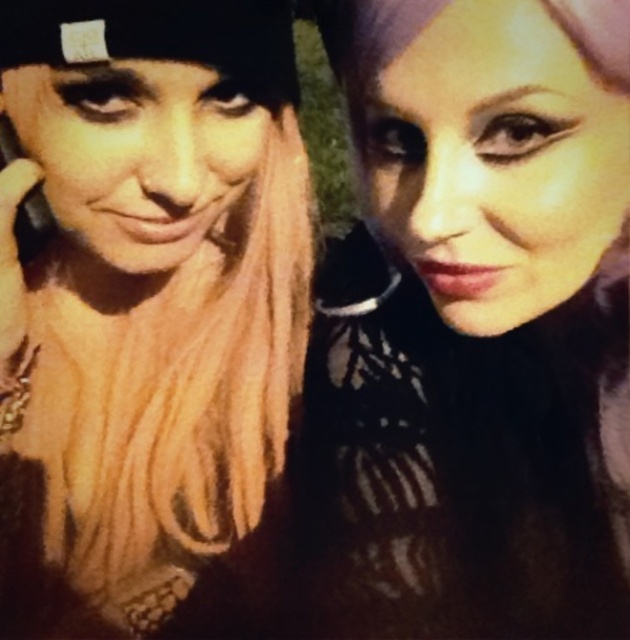
Question: Does matte black hair at center have a lesser width compared to matte black beanie at upper left?

Choices:
 (A) yes
 (B) no

Answer: (B)

Question: Which point appears closest to the camera in this image?

Choices:
 (A) (581, 154)
 (B) (3, 636)

Answer: (A)

Question: Which of the following is the farthest from the observer?

Choices:
 (A) matte black hair at center
 (B) matte black beanie at upper left

Answer: (B)

Question: Is matte black hair at center positioned at the back of matte black beanie at upper left?

Choices:
 (A) yes
 (B) no

Answer: (B)

Question: In this image, where is matte black hair at center located relative to matte black beanie at upper left?

Choices:
 (A) right
 (B) left

Answer: (A)